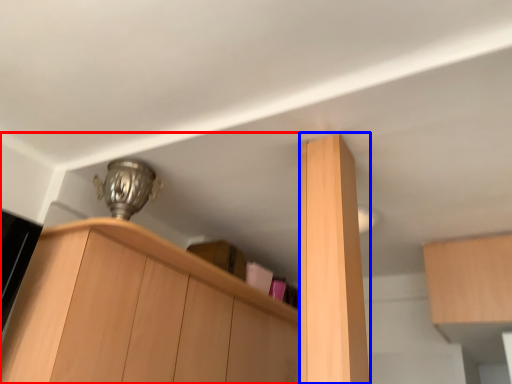
Question: Which object is further to the camera taking this photo, cabinetry (highlighted by a red box) or cabinetry (highlighted by a blue box)?

Choices:
 (A) cabinetry
 (B) cabinetry

Answer: (A)